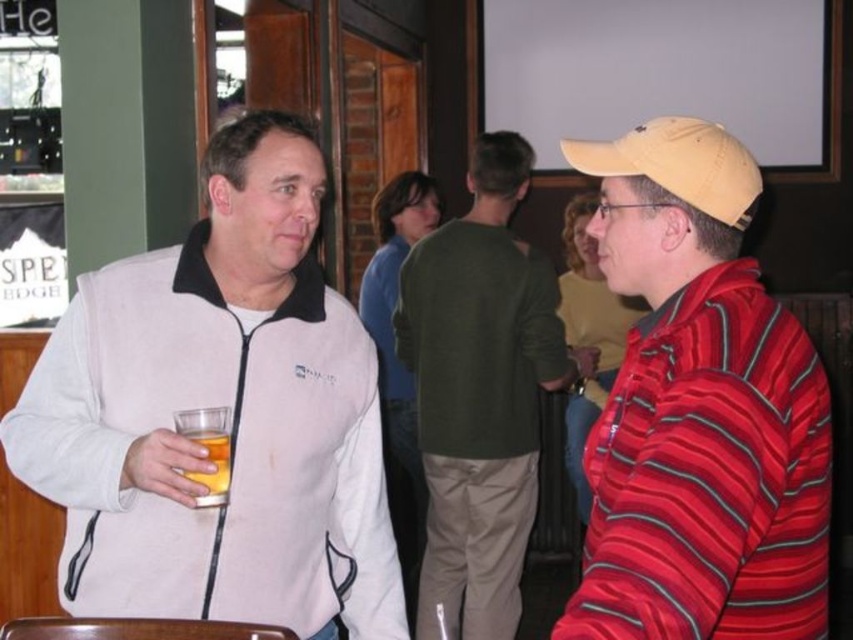
The image size is (853, 640). Find the location of `white fleece jacket at center`. white fleece jacket at center is located at coordinates (219, 404).

Which is behind, point (323, 388) or point (520, 353)?

Positioned behind is point (520, 353).

This screenshot has height=640, width=853. What are the coordinates of `white fleece jacket at center` in the screenshot? It's located at (219, 404).

Does point (227, 508) come behind point (633, 220)?

That is True.

Measure the distance from white fleece jacket at center to striped cotton shirt at right.

white fleece jacket at center and striped cotton shirt at right are 28.90 inches apart from each other.

The height and width of the screenshot is (640, 853). What do you see at coordinates (219, 404) in the screenshot? I see `white fleece jacket at center` at bounding box center [219, 404].

Locate an element on the screen. This screenshot has height=640, width=853. white fleece jacket at center is located at coordinates (219, 404).

From the picture: Does striped cotton shirt at right have a lesser width compared to translucent glass beer at left?

Incorrect, striped cotton shirt at right's width is not less than translucent glass beer at left's.

Which of these two, striped cotton shirt at right or translucent glass beer at left, stands shorter?

Standing shorter between the two is translucent glass beer at left.

Who is more distant from viewer, (730, 476) or (206, 486)?

The point (206, 486) is behind.

In order to click on striped cotton shirt at right in this screenshot , I will do `click(699, 410)`.